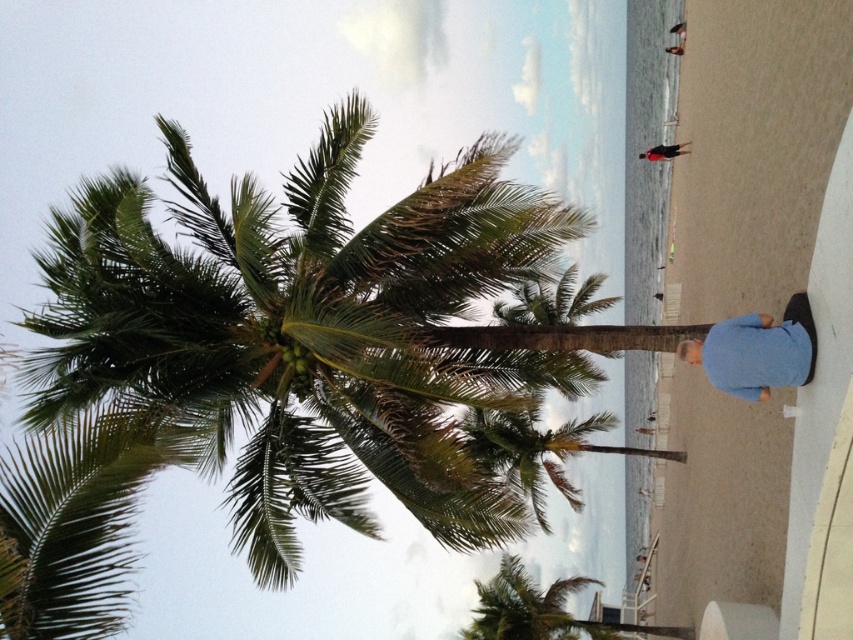
Question: Does blue cotton shirt at lower right appear on the right side of dark blue shirt at center?

Choices:
 (A) no
 (B) yes

Answer: (A)

Question: Which of the following is the farthest from the observer?

Choices:
 (A) blue cotton shirt at lower right
 (B) green leafy coconut tree at center
 (C) dark blue shirt at center

Answer: (C)

Question: Does green leafy palm tree at center have a lesser width compared to dark blue shirt at center?

Choices:
 (A) no
 (B) yes

Answer: (A)

Question: Which point is farther to the camera?

Choices:
 (A) (672, 154)
 (B) (363, 269)
 (C) (672, 33)
 (D) (804, 301)

Answer: (C)

Question: Is dark blue shirt at center thinner than blue shirt at center?

Choices:
 (A) yes
 (B) no

Answer: (B)

Question: Considering the real-world distances, which object is closest to the dark blue shirt at center?

Choices:
 (A) green leafy coconut tree at center
 (B) blue cotton shirt at lower right
 (C) blue shirt at center
 (D) green leafy palm tree at center

Answer: (C)